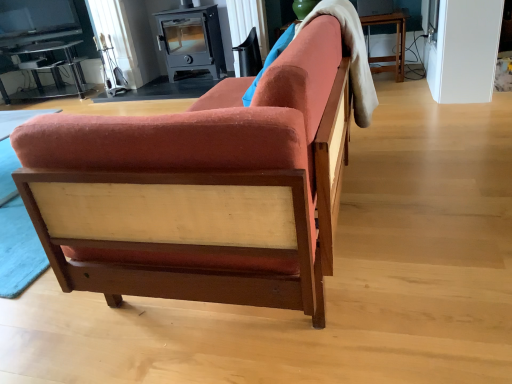
Question: Is velvet orange couch at center thinner than matte black swivel chair at upper center?

Choices:
 (A) yes
 (B) no

Answer: (B)

Question: Can you confirm if velvet orange couch at center is positioned to the left of matte black swivel chair at upper center?

Choices:
 (A) yes
 (B) no

Answer: (B)

Question: From the image's perspective, would you say velvet orange couch at center is shown under matte black swivel chair at upper center?

Choices:
 (A) yes
 (B) no

Answer: (A)

Question: Is velvet orange couch at center located outside matte black swivel chair at upper center?

Choices:
 (A) yes
 (B) no

Answer: (A)

Question: Does velvet orange couch at center lie in front of matte black swivel chair at upper center?

Choices:
 (A) yes
 (B) no

Answer: (A)

Question: Is velvet orange couch at center surrounding matte black swivel chair at upper center?

Choices:
 (A) yes
 (B) no

Answer: (B)

Question: Is there a large distance between matte black swivel chair at upper center and clear glass table at upper left?

Choices:
 (A) no
 (B) yes

Answer: (B)

Question: Does matte black swivel chair at upper center come behind clear glass table at upper left?

Choices:
 (A) no
 (B) yes

Answer: (A)

Question: Is matte black swivel chair at upper center next to clear glass table at upper left?

Choices:
 (A) no
 (B) yes

Answer: (A)

Question: From a real-world perspective, is matte black swivel chair at upper center beneath clear glass table at upper left?

Choices:
 (A) no
 (B) yes

Answer: (A)

Question: Is matte black swivel chair at upper center wider than clear glass table at upper left?

Choices:
 (A) yes
 (B) no

Answer: (B)

Question: Could you tell me if matte black swivel chair at upper center is turned towards clear glass table at upper left?

Choices:
 (A) yes
 (B) no

Answer: (B)

Question: Considering the relative sizes of matte black swivel chair at upper center and velvet orange couch at center in the image provided, is matte black swivel chair at upper center wider than velvet orange couch at center?

Choices:
 (A) yes
 (B) no

Answer: (B)